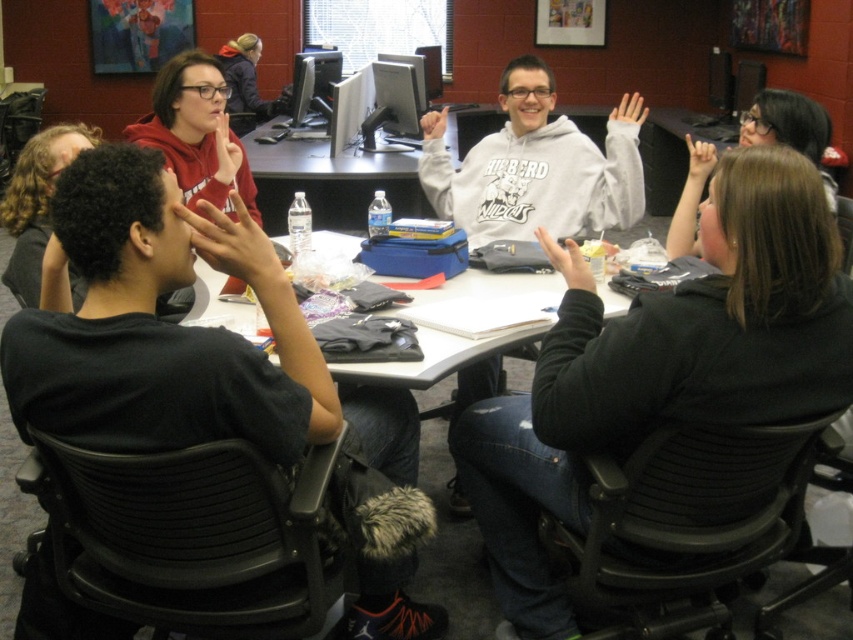
Who is positioned more to the right, black t-shirt at left or matte black hand at upper center?

Positioned to the right is matte black hand at upper center.

Is black t-shirt at left further to the viewer compared to matte black hand at upper center?

That is False.

What do you see at coordinates (209, 376) in the screenshot? Image resolution: width=853 pixels, height=640 pixels. I see `black t-shirt at left` at bounding box center [209, 376].

The image size is (853, 640). What are the coordinates of `black t-shirt at left` in the screenshot? It's located at (209, 376).

Does brown hair at upper right have a smaller size compared to smooth skin hand at center?

Actually, brown hair at upper right might be larger than smooth skin hand at center.

Identify the location of brown hair at upper right. (786, 122).

Does black t-shirt at left come in front of white matte hand at upper center?

Yes, it is.

Does black t-shirt at left appear on the right side of white matte hand at upper center?

In fact, black t-shirt at left is to the left of white matte hand at upper center.

Is point (36, 422) in front of point (630, 109)?

Yes, point (36, 422) is closer to viewer.

The height and width of the screenshot is (640, 853). I want to click on black t-shirt at left, so click(x=209, y=376).